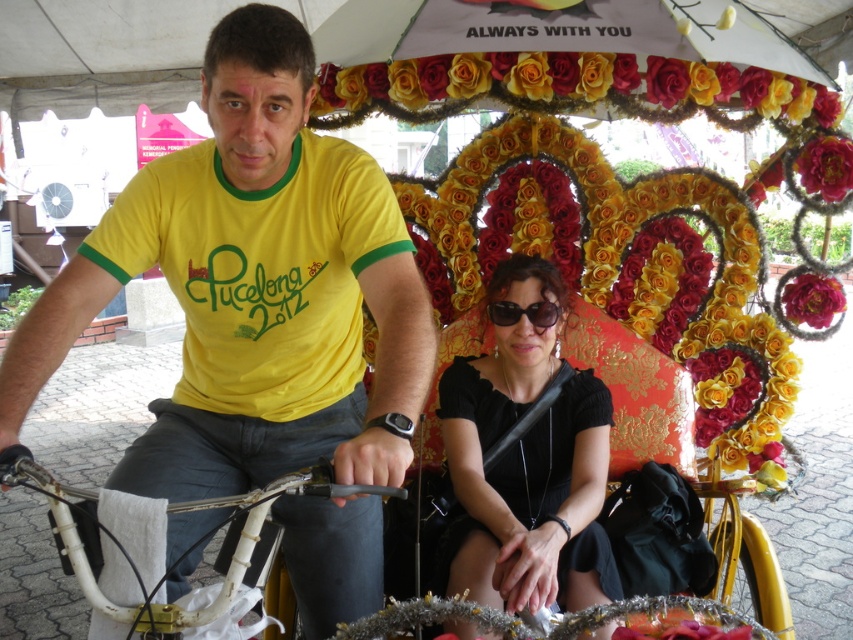
From the picture: You are a photographer positioned in front of the rickshaw and want to capture a closeup shot of the black plastic sunglasses at center while also including the yellow fabric flowers at upper center in the frame. Based on their positions, is it possible to include both in the same photo without moving the camera?

The yellow fabric flowers at upper center are located above the black plastic sunglasses at center, so yes, it is possible to capture both in the same photo by adjusting the camera angle or zoom to include both the upper and lower areas of the rickshaw.

You are a photographer taking a picture of the yellow fabric flowers at upper center and the deep red silk flower at center. Which flower arrangement is closer to the camera?

The yellow fabric flowers at upper center are closer to the camera because they are in front of the deep red silk flower at center.